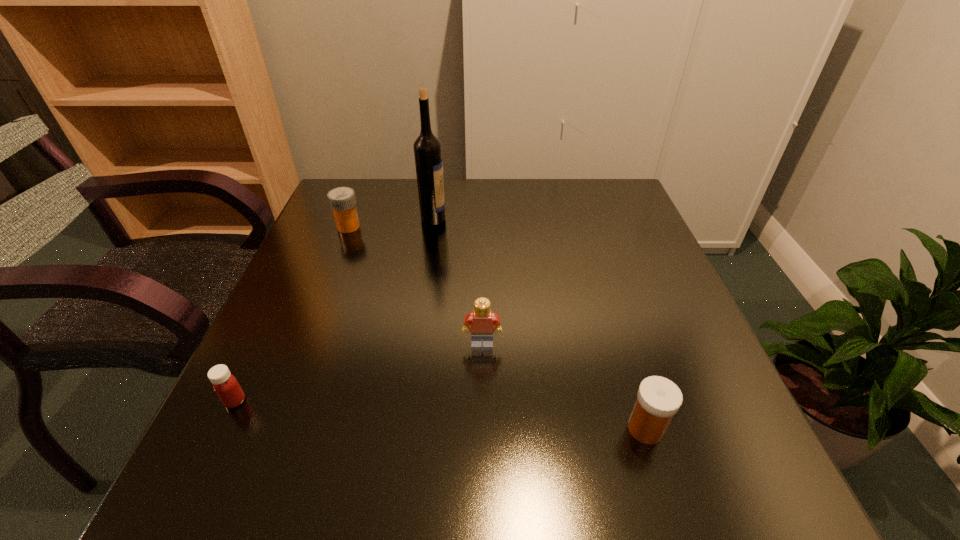
The image size is (960, 540). I want to click on the third object from right to left, so click(x=427, y=148).

At what (x,y) coordinates should I click in order to perform the action: click on wine bottle. Please return your answer as a coordinate pair (x, y). This screenshot has height=540, width=960. Looking at the image, I should click on (427, 148).

Image resolution: width=960 pixels, height=540 pixels. I want to click on the fourth shortest object, so click(x=482, y=321).

The image size is (960, 540). I want to click on Lego, so click(482, 321).

Locate an element on the screen. The image size is (960, 540). the second object from left to right is located at coordinates (342, 201).

I want to click on the farthest medicine, so click(342, 201).

You are a GUI agent. You are given a task and a screenshot of the screen. Output one action in this format:
    pyautogui.click(x=<x>, y=<y>)
    Task: Click on the rightmost object
    Image resolution: width=960 pixels, height=540 pixels.
    Given the screenshot: What is the action you would take?
    pyautogui.click(x=658, y=399)

This screenshot has height=540, width=960. I want to click on the nearest object, so click(x=658, y=399).

The height and width of the screenshot is (540, 960). What are the coordinates of `the second nearest object` in the screenshot? It's located at (226, 386).

Where is `the shortest medicine`? This screenshot has height=540, width=960. the shortest medicine is located at coordinates (226, 386).